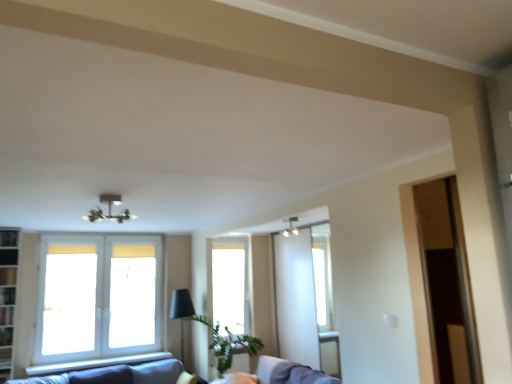
Question: Is transparent glass window at center, acting as the 1th window starting from the back, with metallic chandelier at upper center?

Choices:
 (A) yes
 (B) no

Answer: (B)

Question: From the image's perspective, would you say transparent glass window at center, acting as the 1th window starting from the back, is shown under metallic chandelier at upper center?

Choices:
 (A) yes
 (B) no

Answer: (A)

Question: Considering the relative sizes of transparent glass window at center, the second window from the front, and metallic chandelier at upper center in the image provided, is transparent glass window at center, the second window from the front, taller than metallic chandelier at upper center?

Choices:
 (A) yes
 (B) no

Answer: (A)

Question: Would you say transparent glass window at center, placed as the second window when sorted from left to right, is outside metallic chandelier at upper center?

Choices:
 (A) yes
 (B) no

Answer: (A)

Question: From a real-world perspective, is transparent glass window at center, which is counted as the first window, starting from the right, over metallic chandelier at upper center?

Choices:
 (A) no
 (B) yes

Answer: (A)

Question: Can you confirm if metallic chandelier at upper center is shorter than white fabric swivel chair at lower center?

Choices:
 (A) yes
 (B) no

Answer: (A)

Question: Can you confirm if metallic chandelier at upper center is bigger than white fabric swivel chair at lower center?

Choices:
 (A) no
 (B) yes

Answer: (A)

Question: Is metallic chandelier at upper center wider than white fabric swivel chair at lower center?

Choices:
 (A) no
 (B) yes

Answer: (A)

Question: Is metallic chandelier at upper center not inside white fabric swivel chair at lower center?

Choices:
 (A) no
 (B) yes

Answer: (B)

Question: From the image's perspective, is metallic chandelier at upper center below white fabric swivel chair at lower center?

Choices:
 (A) yes
 (B) no

Answer: (B)

Question: Is metallic chandelier at upper center in front of white fabric swivel chair at lower center?

Choices:
 (A) yes
 (B) no

Answer: (A)

Question: From the image's perspective, is metallic chandelier at upper center beneath white glass window at left, which is counted as the 2th window, starting from the right?

Choices:
 (A) no
 (B) yes

Answer: (A)